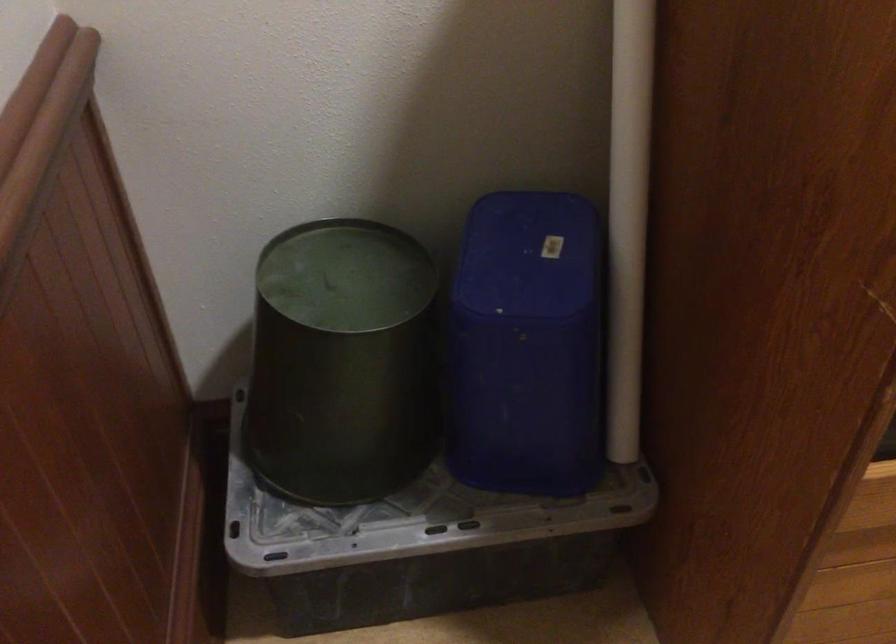
At what (x,y) coordinates should I click in order to perform the action: click on green metal can. Please return your answer as a coordinate pair (x, y). Looking at the image, I should click on 342,362.